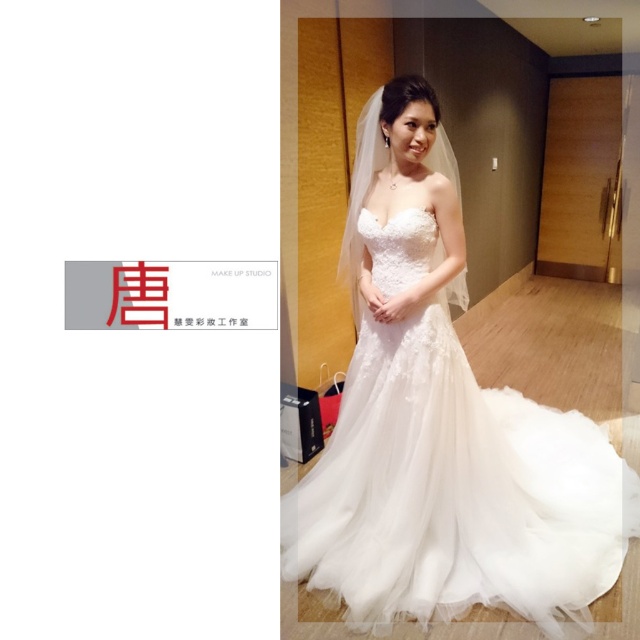
Can you confirm if white lace dress at center is smaller than white lace veil at upper center?

Actually, white lace dress at center might be larger than white lace veil at upper center.

Is point (488, 388) farther from viewer compared to point (380, 134)?

Yes, point (488, 388) is behind point (380, 134).

Locate an element on the screen. The image size is (640, 640). white lace dress at center is located at coordinates (440, 422).